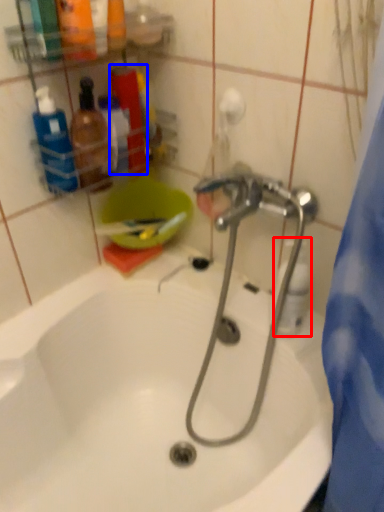
Question: Which object appears farthest to the camera in this image, cleaning product (highlighted by a red box) or toiletry (highlighted by a blue box)?

Choices:
 (A) cleaning product
 (B) toiletry

Answer: (B)